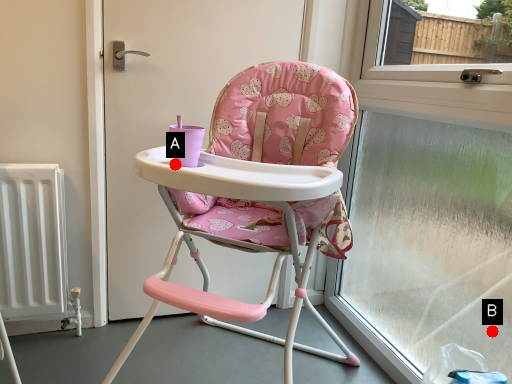
Question: Two points are circled on the image, labeled by A and B beside each circle. Which point appears farthest from the camera in this image?

Choices:
 (A) A is further
 (B) B is further

Answer: (B)